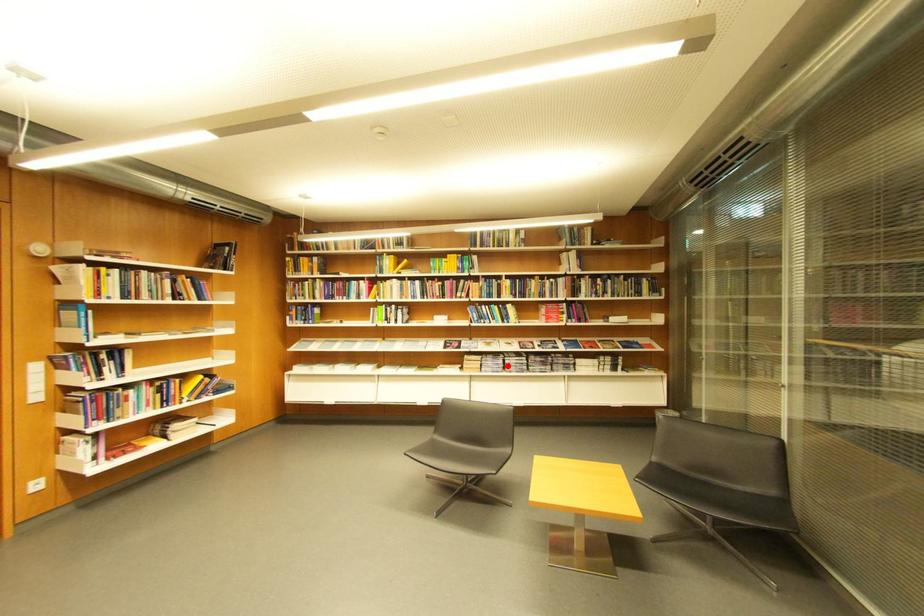
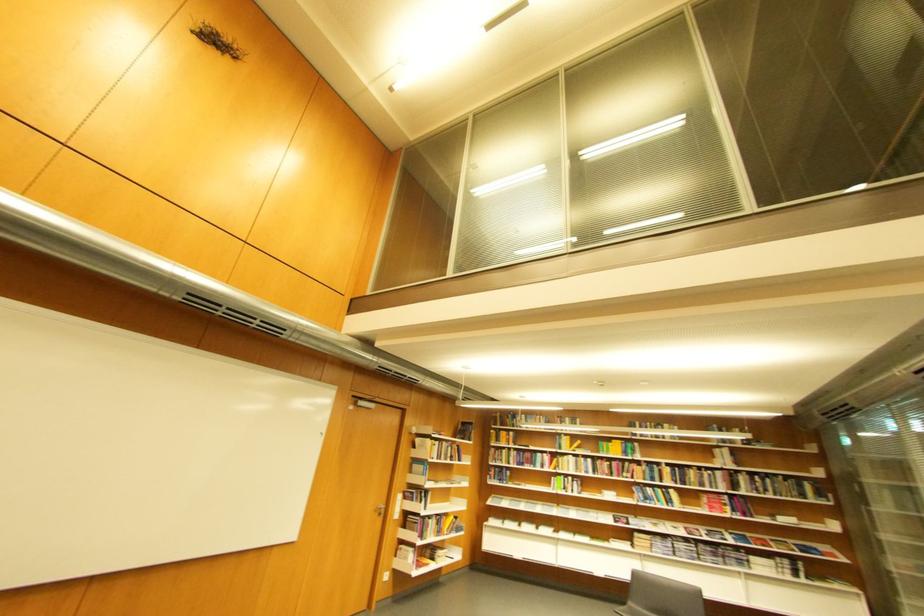
In the second image, find the point that corresponds to the highlighted location in the first image.

(677, 549)